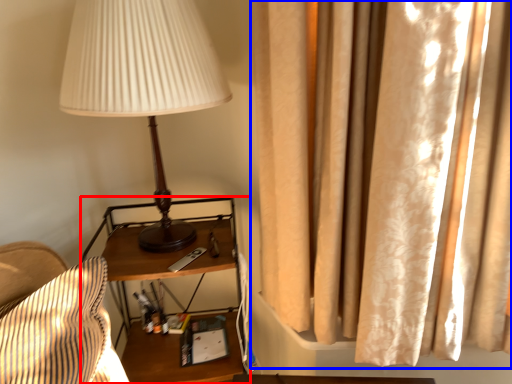
Question: Which point is further to the camera, nightstand (highlighted by a red box) or curtain (highlighted by a blue box)?

Choices:
 (A) nightstand
 (B) curtain

Answer: (A)